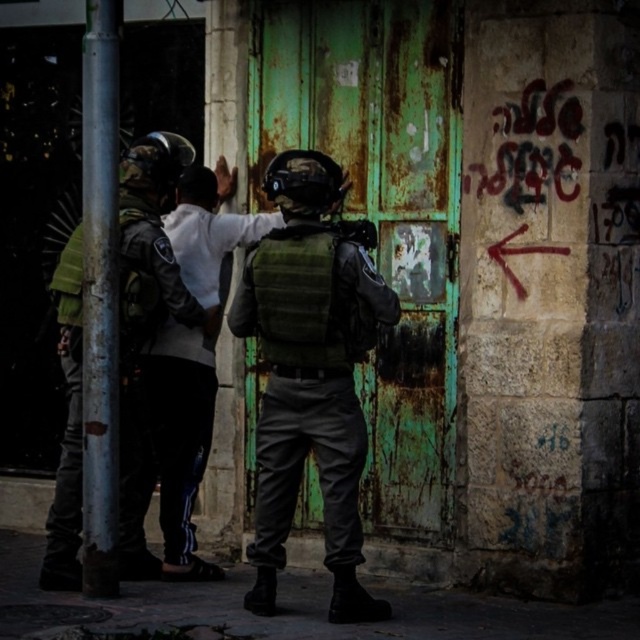
Can you confirm if green matte vest at center is shorter than white cotton shirt at left?

Yes, green matte vest at center is shorter than white cotton shirt at left.

Which is more to the left, green matte vest at center or white cotton shirt at left?

From the viewer's perspective, white cotton shirt at left appears more on the left side.

I want to click on green matte vest at center, so click(308, 376).

Between point (300, 476) and point (92, 204), which one is positioned behind?

The point (92, 204) is behind.

Looking at this image, does green matte vest at center appear over silver metallic pole at left?

No.

Which is in front, point (339, 572) or point (99, 483)?

Point (339, 572) is in front.

This screenshot has height=640, width=640. In order to click on green matte vest at center in this screenshot , I will do `click(308, 376)`.

Is white cotton shirt at left above silver metallic pole at left?

No.

Find the location of a particular element. This screenshot has width=640, height=640. white cotton shirt at left is located at coordinates (145, 320).